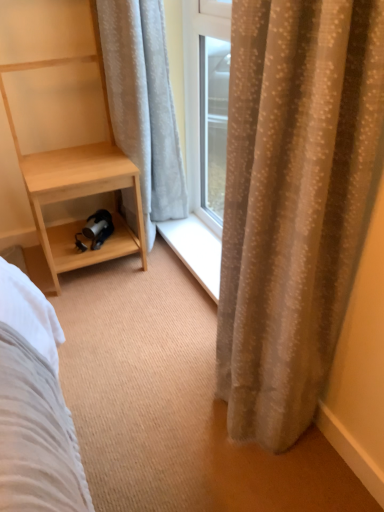
Question: Is there a large distance between light wood/texture shelf at left and beige textured curtain at right, positioned as the 1th curtain in front-to-back order?

Choices:
 (A) no
 (B) yes

Answer: (A)

Question: From the image's perspective, is light wood/texture shelf at left under beige textured curtain at right, which is counted as the second curtain, starting from the back?

Choices:
 (A) no
 (B) yes

Answer: (A)

Question: Is light wood/texture shelf at left positioned before beige textured curtain at right, positioned as the 1th curtain in front-to-back order?

Choices:
 (A) yes
 (B) no

Answer: (B)

Question: Can you confirm if light wood/texture shelf at left is shorter than beige textured curtain at right, positioned as the 1th curtain in front-to-back order?

Choices:
 (A) yes
 (B) no

Answer: (A)

Question: Considering the relative sizes of light wood/texture shelf at left and beige textured curtain at right, acting as the 2th curtain starting from the left, in the image provided, is light wood/texture shelf at left wider than beige textured curtain at right, acting as the 2th curtain starting from the left,?

Choices:
 (A) yes
 (B) no

Answer: (A)

Question: Is light wood/texture shelf at left to the left or to the right of beige textured curtain at right, which is counted as the second curtain, starting from the back, in the image?

Choices:
 (A) right
 (B) left

Answer: (B)

Question: Is light wood/texture shelf at left taller or shorter than beige textured curtain at right, acting as the 2th curtain starting from the left?

Choices:
 (A) tall
 (B) short

Answer: (B)

Question: From the image's perspective, is light wood/texture shelf at left above or below beige textured curtain at right, positioned as the 1th curtain in front-to-back order?

Choices:
 (A) below
 (B) above

Answer: (B)

Question: In the image, is light wood/texture shelf at left positioned in front of or behind beige textured curtain at right, acting as the 2th curtain starting from the left?

Choices:
 (A) front
 (B) behind

Answer: (B)

Question: From the image's perspective, is beige textured curtain at right, acting as the 2th curtain starting from the left, above or below light wood/texture shelf at left?

Choices:
 (A) above
 (B) below

Answer: (B)

Question: Considering the positions of beige textured curtain at right, positioned as the 1th curtain in right-to-left order, and light wood/texture shelf at left in the image, is beige textured curtain at right, positioned as the 1th curtain in right-to-left order, taller or shorter than light wood/texture shelf at left?

Choices:
 (A) short
 (B) tall

Answer: (B)

Question: Which is correct: beige textured curtain at right, positioned as the 1th curtain in front-to-back order, is inside light wood/texture shelf at left, or outside of it?

Choices:
 (A) inside
 (B) outside

Answer: (B)

Question: Visually, is beige textured curtain at right, acting as the 2th curtain starting from the left, positioned to the left or to the right of light wood/texture shelf at left?

Choices:
 (A) right
 (B) left

Answer: (A)

Question: In the image, is light wood/texture shelf at left on the left side or the right side of white textured curtain at left, the 2th curtain when ordered from right to left?

Choices:
 (A) left
 (B) right

Answer: (A)

Question: Considering their positions, is light wood/texture shelf at left located in front of or behind white textured curtain at left, marked as the first curtain in a back-to-front arrangement?

Choices:
 (A) behind
 (B) front

Answer: (B)